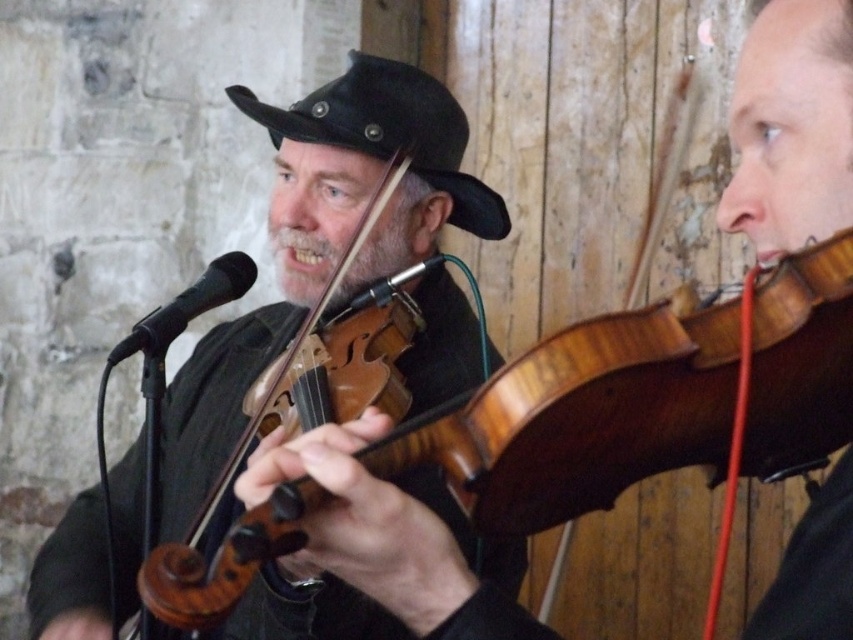
Question: Considering the relative positions of wooden violin at center and black leather hat at center in the image provided, where is wooden violin at center located with respect to black leather hat at center?

Choices:
 (A) right
 (B) left

Answer: (B)

Question: Is wooden violin at center smaller than black leather hat at center?

Choices:
 (A) no
 (B) yes

Answer: (A)

Question: Which point is farther to the camera?

Choices:
 (A) wooden violin at center
 (B) black leather hat at center

Answer: (B)

Question: Which of the following is the closest to the observer?

Choices:
 (A) (473, 364)
 (B) (425, 144)

Answer: (B)

Question: Which point appears closest to the camera in this image?

Choices:
 (A) click(x=259, y=122)
 (B) click(x=434, y=104)

Answer: (A)

Question: Is wooden violin at center wider than black leather hat at center?

Choices:
 (A) no
 (B) yes

Answer: (B)